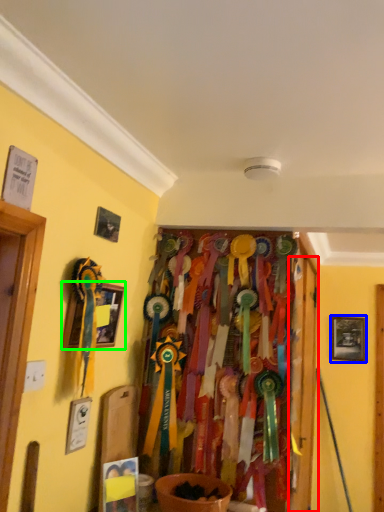
Question: Which object is positioned closest to door (highlighted by a red box)? Select from picture frame (highlighted by a blue box) and picture frame (highlighted by a green box).

Choices:
 (A) picture frame
 (B) picture frame

Answer: (B)